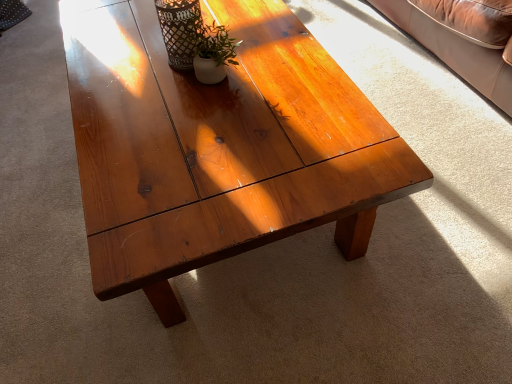
Question: Is matte black vase at upper center wider or thinner than matte white vase at center?

Choices:
 (A) wide
 (B) thin

Answer: (A)

Question: Considering the positions of matte black vase at upper center and matte white vase at center in the image, is matte black vase at upper center bigger or smaller than matte white vase at center?

Choices:
 (A) big
 (B) small

Answer: (A)

Question: Which of these objects is positioned closest to the satin wood coffee table at center?

Choices:
 (A) matte white vase at center
 (B) matte black vase at upper center

Answer: (A)

Question: Based on their relative distances, which object is farther from the satin wood coffee table at center?

Choices:
 (A) matte black vase at upper center
 (B) matte white vase at center

Answer: (A)